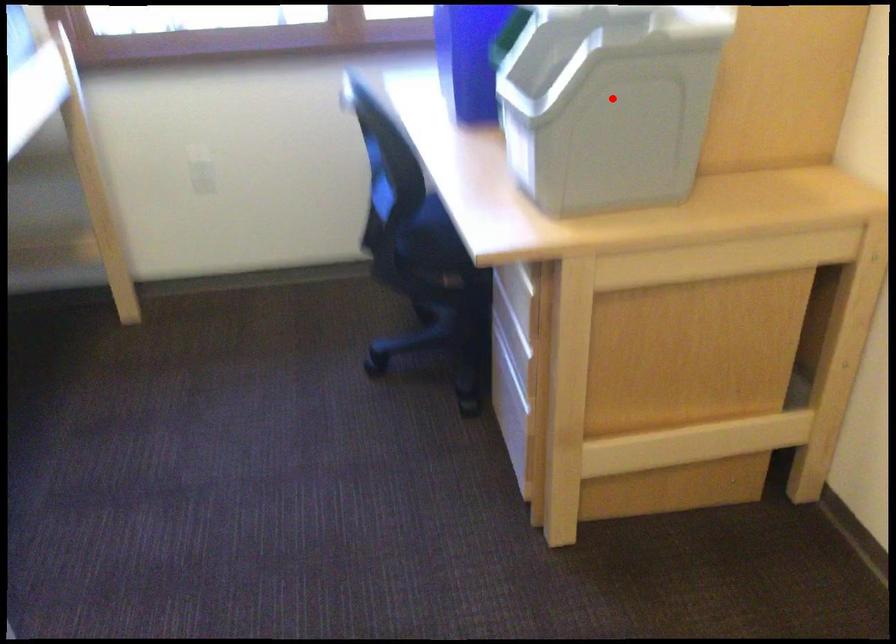
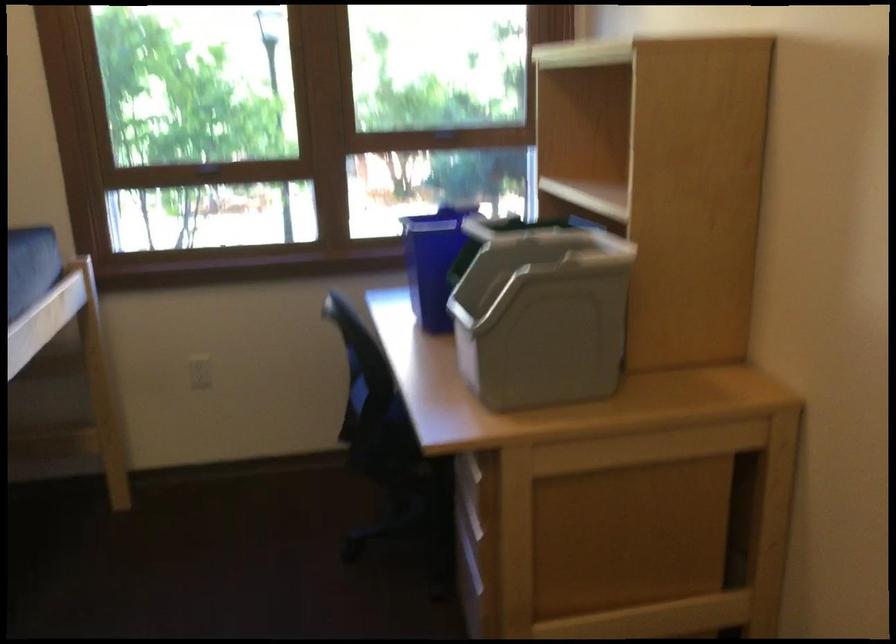
Find the pixel in the second image that matches the highlighted location in the first image.

(540, 313)